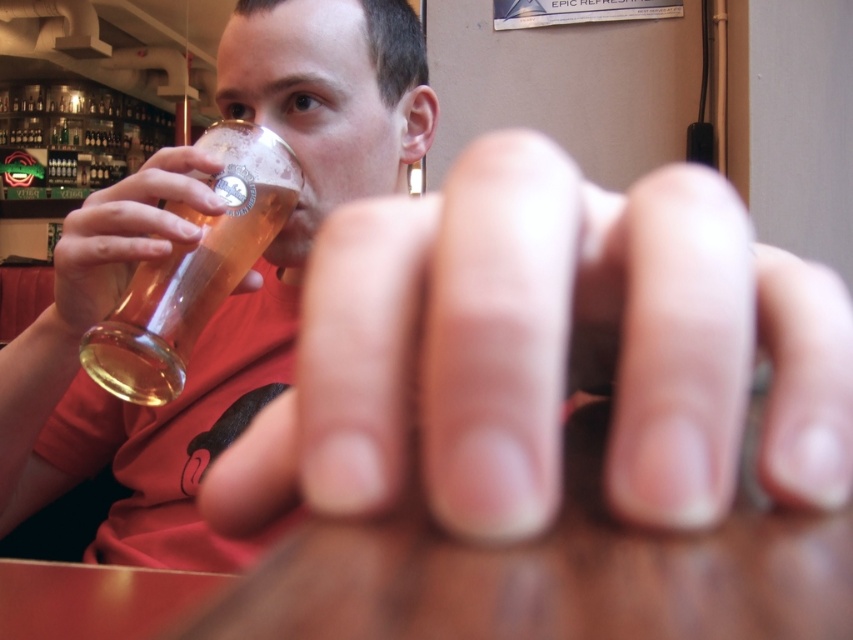
You are looking at the scene and notice two points marked on the image. The first point is at coordinate point(169,323) and the second is at point(161,195). Which point is closer to the camera?

Point(169,323) is closer to the camera than point(161,195) because it is further to the camera.

You are a bartender and need to place a coaster under the translucent glass mug at left and the translucent glass beer at upper left. Which one requires a larger coaster to cover its base?

The translucent glass mug at left requires a larger coaster because it has a greater height than the translucent glass beer at upper left, implying its base might be wider.

You are at a bar and want to grab the translucent glass beer at upper left. There is also a translucent glass mug at left on the table. Which one is closer to your right hand if you are sitting at the table?

The translucent glass mug at left is to the right of the translucent glass beer at upper left, so the translucent glass mug at left is closer to your right hand.